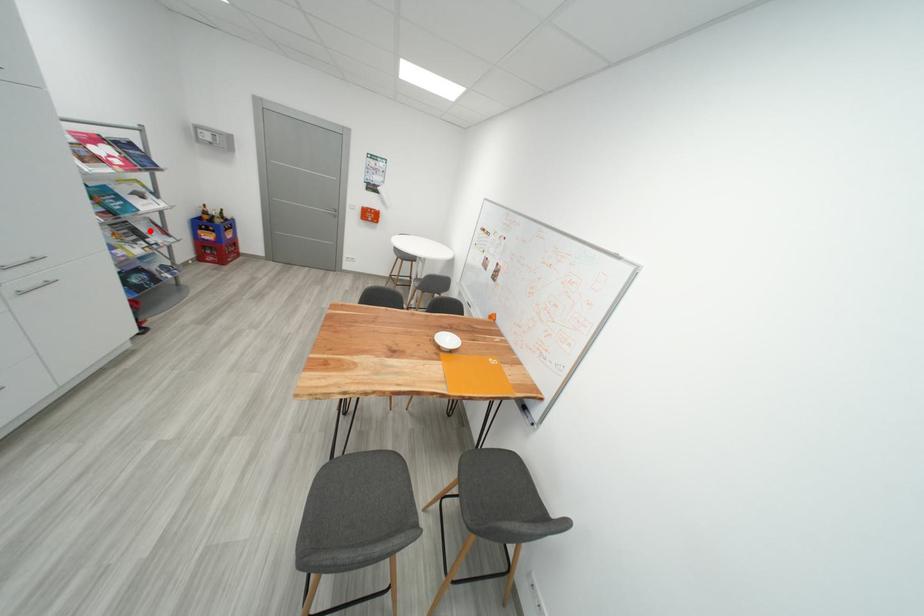
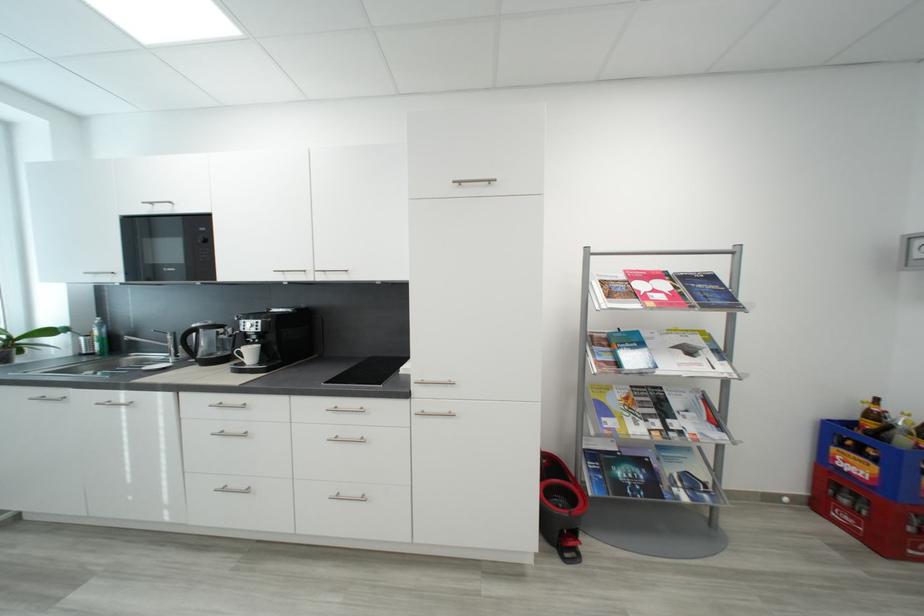
Find the pixel in the second image that matches the highlighted location in the first image.

(684, 406)